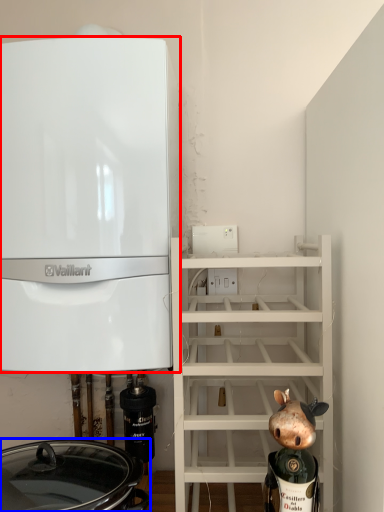
Question: Which object is closer to the camera taking this photo, home appliance (highlighted by a red box) or crock pot (highlighted by a blue box)?

Choices:
 (A) home appliance
 (B) crock pot

Answer: (B)